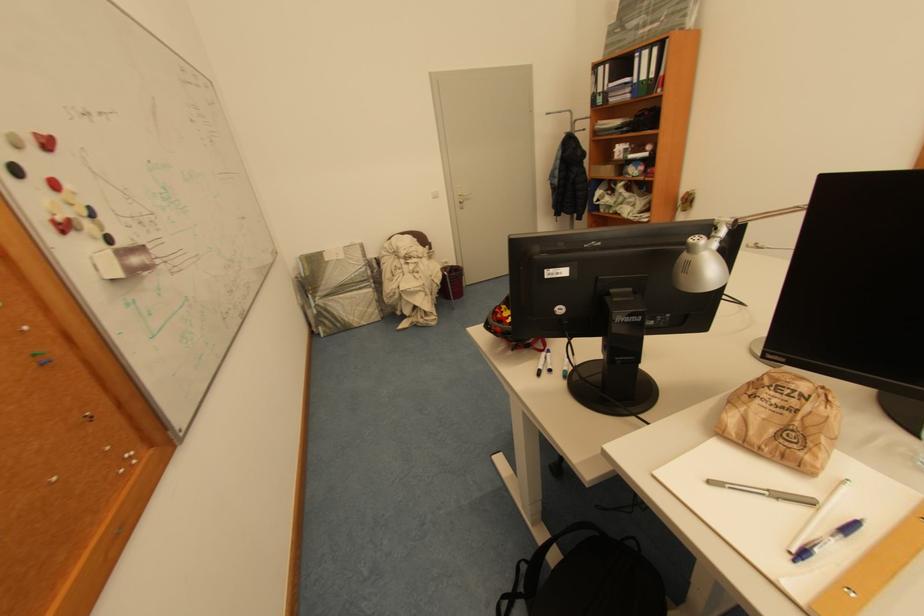
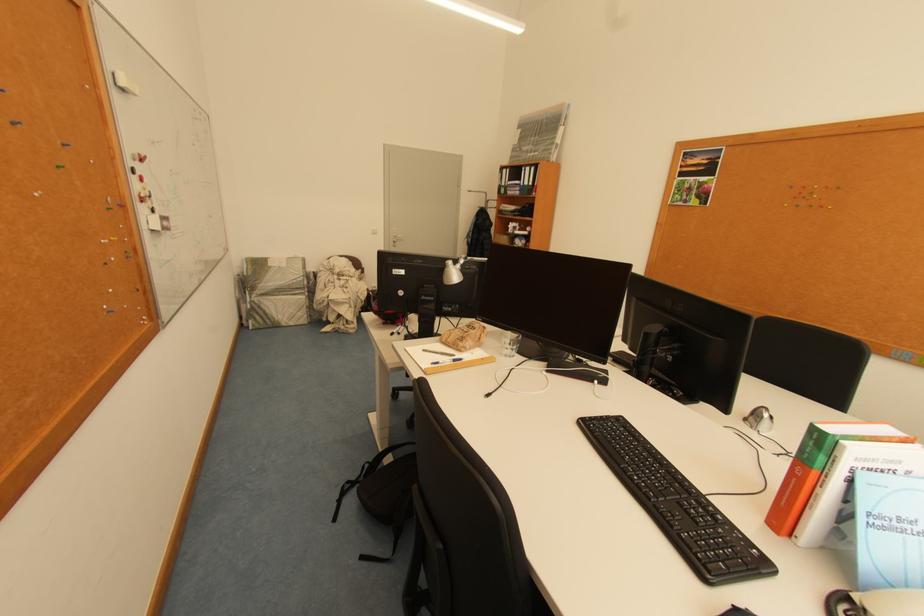
Find the pixel in the second image that matches (813,554) in the first image.

(445, 363)